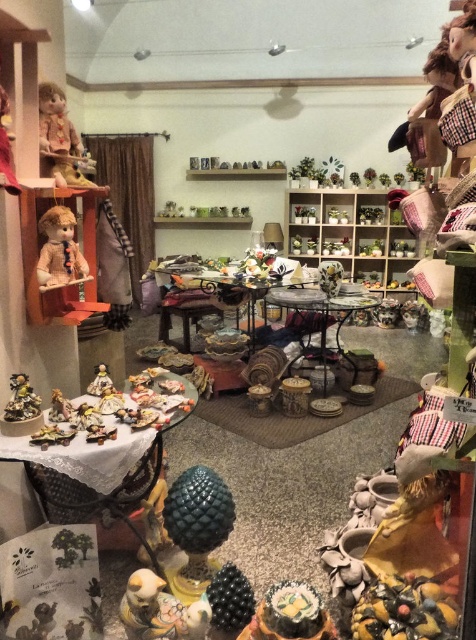
You are standing in the room and want to place a small ceramic bird figurine on the metallic dark brown table at center. Where exactly should you place it to ensure it sits at the point labeled as point (317,320)?

Place the small ceramic bird figurine at point (317,320) on the metallic dark brown table at center.